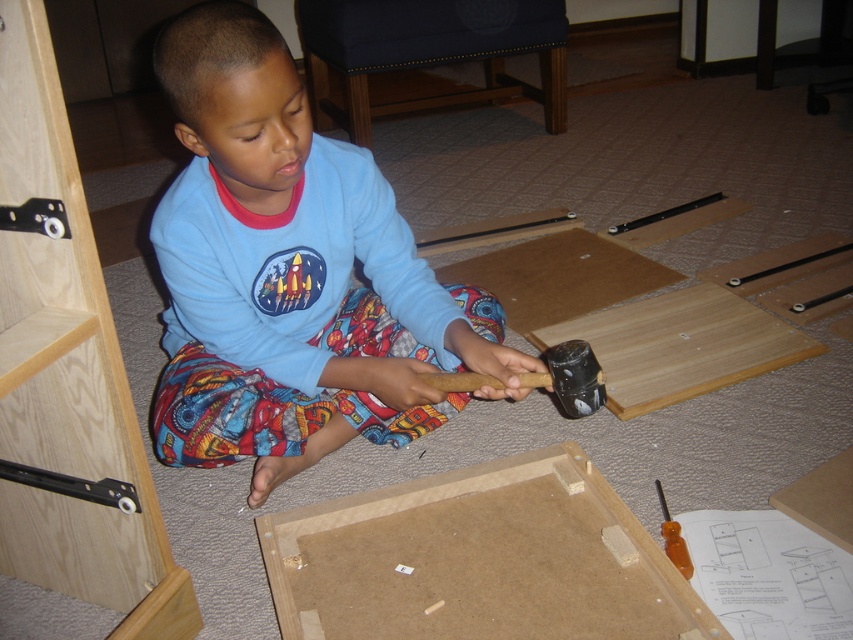
Is blue cotton shirt at center to the right of black rubber hammer at center from the viewer's perspective?

No, blue cotton shirt at center is not to the right of black rubber hammer at center.

Which is in front, point (231, 177) or point (585, 348)?

Point (585, 348) is in front.

The height and width of the screenshot is (640, 853). What are the coordinates of `blue cotton shirt at center` in the screenshot? It's located at (291, 273).